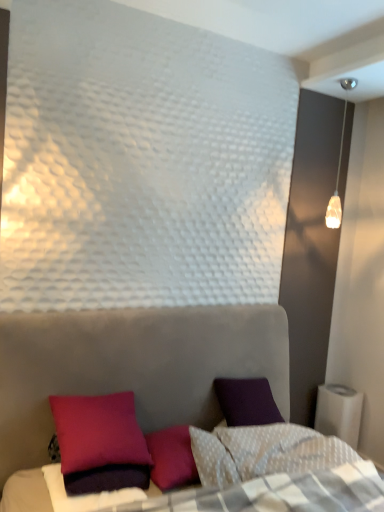
Question: From the image's perspective, is velvet purple pillow at lower left above or below translucent glass pendant light at upper right?

Choices:
 (A) above
 (B) below

Answer: (B)

Question: Is point (97, 402) positioned closer to the camera than point (334, 208)?

Choices:
 (A) closer
 (B) farther

Answer: (A)

Question: Which is farther from the translucent glass pendant light at upper right?

Choices:
 (A) velvet purple pillow at lower left
 (B) purple matte pillow at lower left

Answer: (B)

Question: Estimate the real-world distances between objects in this image. Which object is closer to the velvet purple pillow at lower left?

Choices:
 (A) translucent glass pendant light at upper right
 (B) purple matte pillow at lower left

Answer: (B)